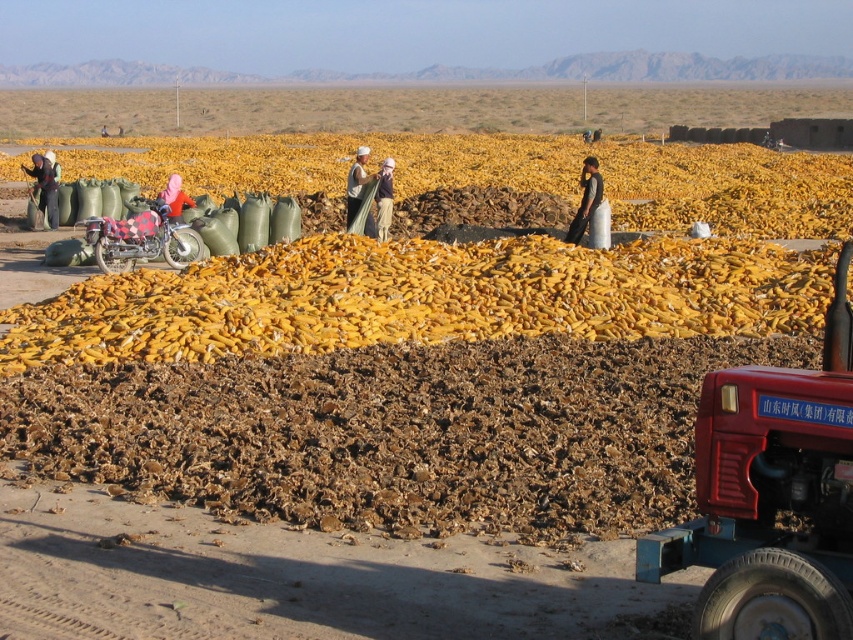
You are a worker in the field and need to locate the black fabric at center. According to the coordinates given, where would you find it?

The black fabric at center is located at coordinates point (585, 198).

You are a worker in the field and need to move the black fabric at center to the matte white shirt at center. Can you do it without walking more than 3 meters?

The distance between the black fabric at center and the matte white shirt at center is 2.98 meters, so yes, you can move the black fabric at center to the matte white shirt at center without exceeding 3 meters.